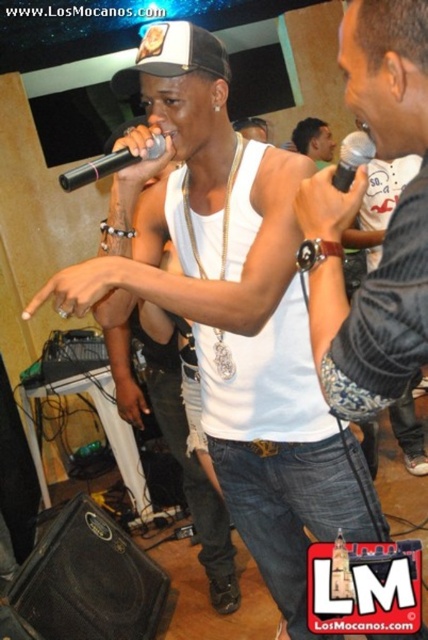
Can you confirm if matte black shirt at center is shorter than black metallic microphone at center?

Incorrect, matte black shirt at center's height does not fall short of black metallic microphone at center's.

How distant is matte black shirt at center from black metallic microphone at center?

matte black shirt at center and black metallic microphone at center are 2.72 meters apart from each other.

Where is `matte black shirt at center`? This screenshot has height=640, width=428. matte black shirt at center is located at coordinates (314, 140).

Can you confirm if denim jacket at right is positioned to the right of black matte microphone at center?

Indeed, denim jacket at right is positioned on the right side of black matte microphone at center.

Find the location of a particular element. The image size is (428, 640). denim jacket at right is located at coordinates (380, 204).

At what (x,y) coordinates should I click in order to perform the action: click on denim jacket at right. Please return your answer as a coordinate pair (x, y). Looking at the image, I should click on (380, 204).

Between denim jacket at right and black metallic microphone at center, which one appears on the right side from the viewer's perspective?

Positioned to the right is denim jacket at right.

Is denim jacket at right closer to camera compared to black metallic microphone at center?

No, it is behind black metallic microphone at center.

At what (x,y) coordinates should I click in order to perform the action: click on denim jacket at right. Please return your answer as a coordinate pair (x, y). The width and height of the screenshot is (428, 640). Looking at the image, I should click on (380, 204).